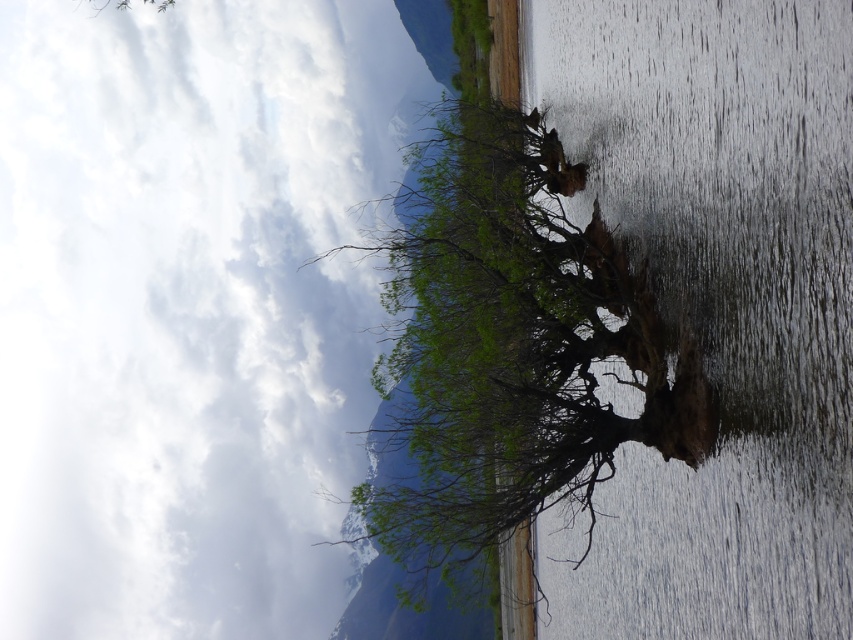
Is green leafy tree at upper center shorter than green leafy tree at center?

Incorrect, green leafy tree at upper center's height does not fall short of green leafy tree at center's.

Does green leafy tree at upper center appear over green leafy tree at center?

Correct, green leafy tree at upper center is located above green leafy tree at center.

Identify the location of green leafy tree at upper center. This screenshot has height=640, width=853. (189, 308).

Does point (648, 579) come farther from viewer compared to point (450, 150)?

No, (648, 579) is in front of (450, 150).

Does brown rough tree trunk at center have a lesser width compared to green leafy tree at center?

Correct, brown rough tree trunk at center's width is less than green leafy tree at center's.

Who is more forward, (802, 413) or (500, 493)?

Point (802, 413) is in front.

Where is `brown rough tree trunk at center`? This screenshot has height=640, width=853. brown rough tree trunk at center is located at coordinates (717, 305).

Is green leafy tree at upper center thinner than brown rough tree trunk at center?

No, green leafy tree at upper center is not thinner than brown rough tree trunk at center.

Can you confirm if green leafy tree at upper center is taller than brown rough tree trunk at center?

Correct, green leafy tree at upper center is much taller as brown rough tree trunk at center.

Is point (202, 168) positioned in front of point (606, 77)?

That is False.

I want to click on green leafy tree at upper center, so click(x=189, y=308).